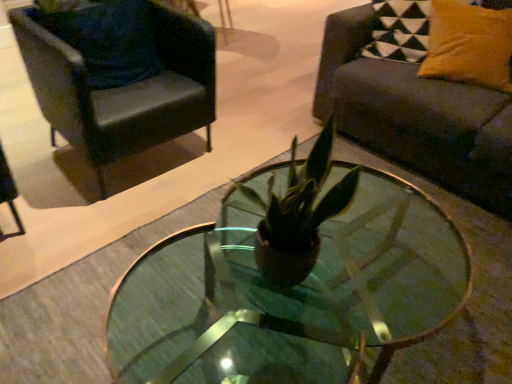
Question: Is dark gray fabric couch at right to the left of velvet dark blue pillow at upper left, marked as the 2th pillow in a right-to-left arrangement, from the viewer's perspective?

Choices:
 (A) yes
 (B) no

Answer: (B)

Question: From a real-world perspective, is dark gray fabric couch at right located higher than velvet dark blue pillow at upper left, marked as the 2th pillow in a right-to-left arrangement?

Choices:
 (A) yes
 (B) no

Answer: (B)

Question: Can velvet dark blue pillow at upper left, positioned as the 1th pillow in left-to-right order, be found inside dark gray fabric couch at right?

Choices:
 (A) no
 (B) yes

Answer: (A)

Question: Are dark gray fabric couch at right and velvet dark blue pillow at upper left, positioned as the 1th pillow in left-to-right order, far apart?

Choices:
 (A) no
 (B) yes

Answer: (B)

Question: Does dark gray fabric couch at right lie in front of velvet dark blue pillow at upper left, positioned as the 1th pillow in left-to-right order?

Choices:
 (A) no
 (B) yes

Answer: (B)

Question: From a real-world perspective, does dark gray fabric couch at right sit lower than velvet dark blue pillow at upper left, marked as the 2th pillow in a right-to-left arrangement?

Choices:
 (A) no
 (B) yes

Answer: (B)

Question: Is transparent glass coffee table at center aimed at black leather chair at upper left?

Choices:
 (A) no
 (B) yes

Answer: (B)

Question: Is transparent glass coffee table at center completely or partially outside of black leather chair at upper left?

Choices:
 (A) yes
 (B) no

Answer: (A)

Question: From a real-world perspective, is transparent glass coffee table at center below black leather chair at upper left?

Choices:
 (A) no
 (B) yes

Answer: (B)

Question: From the image's perspective, is transparent glass coffee table at center located beneath black leather chair at upper left?

Choices:
 (A) no
 (B) yes

Answer: (B)

Question: Is black leather chair at upper left completely or partially inside transparent glass coffee table at center?

Choices:
 (A) no
 (B) yes

Answer: (A)

Question: Can you confirm if transparent glass coffee table at center is bigger than black leather chair at upper left?

Choices:
 (A) yes
 (B) no

Answer: (A)

Question: Is black leather chair at upper left not within transparent glass coffee table at center?

Choices:
 (A) no
 (B) yes

Answer: (B)